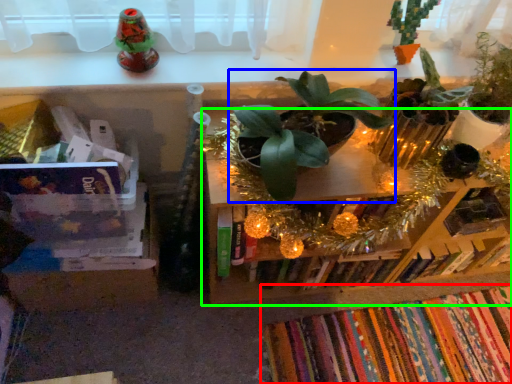
Question: Which object is the farthest from book (highlighted by a red box)? Choose among these: houseplant (highlighted by a blue box) or shelf (highlighted by a green box).

Choices:
 (A) houseplant
 (B) shelf

Answer: (A)